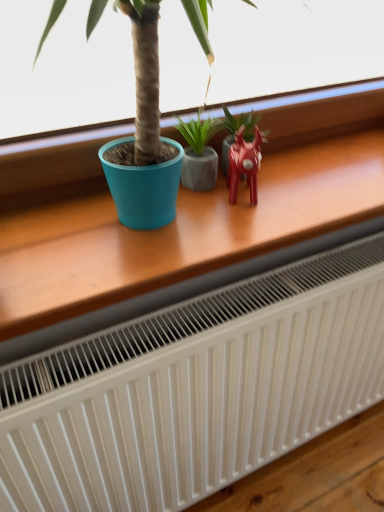
Find the location of `matte gray pot at center, which is counted as the first houseplant, starting from the left`. matte gray pot at center, which is counted as the first houseplant, starting from the left is located at coordinates (199, 150).

The image size is (384, 512). What are the coordinates of `glossy plastic reindeer at center right` in the screenshot? It's located at (244, 163).

You are a GUI agent. You are given a task and a screenshot of the screen. Output one action in this format:
    pyautogui.click(x=<x>, y=<y>)
    Task: Click on the matte gray pot at center, which is counted as the first houseplant, starting from the left
    Image resolution: width=384 pixels, height=512 pixels.
    Given the screenshot: What is the action you would take?
    pyautogui.click(x=199, y=150)

Does point (251, 180) lie in front of point (204, 166)?

That is True.

How different are the orientations of glossy plastic reindeer at center right and matte gray pot at center, which is counted as the first houseplant, starting from the left, in degrees?

There is a 28-degree angle between the facing directions of glossy plastic reindeer at center right and matte gray pot at center, which is counted as the first houseplant, starting from the left.

Is the position of glossy plastic reindeer at center right more distant than that of matte gray pot at center, the 2th houseplant when ordered from right to left?

No, glossy plastic reindeer at center right is in front of matte gray pot at center, the 2th houseplant when ordered from right to left.

From the image's perspective, is glossy plastic reindeer at center right below matte gray pot at center, the 2th houseplant when ordered from right to left?

Yes, from the image's perspective, glossy plastic reindeer at center right is below matte gray pot at center, the 2th houseplant when ordered from right to left.

How many degrees apart are the facing directions of matte gray pot at center, which is counted as the first houseplant, starting from the left, and glossy ceramic plant at center, the second houseplant when ordered from left to right?

0.436 degrees separate the facing orientations of matte gray pot at center, which is counted as the first houseplant, starting from the left, and glossy ceramic plant at center, the second houseplant when ordered from left to right.

Does matte gray pot at center, the 2th houseplant when ordered from right to left, have a larger size compared to glossy ceramic plant at center, the 1th houseplant positioned from the right?

No.

In terms of height, does matte gray pot at center, which is counted as the first houseplant, starting from the left, look taller or shorter compared to glossy ceramic plant at center, the 1th houseplant positioned from the right?

matte gray pot at center, which is counted as the first houseplant, starting from the left, is taller than glossy ceramic plant at center, the 1th houseplant positioned from the right.

Who is shorter, matte gray pot at center, the 2th houseplant when ordered from right to left, or wooden table at center?

Standing shorter between the two is matte gray pot at center, the 2th houseplant when ordered from right to left.

Is matte gray pot at center, the 2th houseplant when ordered from right to left, inside the boundaries of wooden table at center, or outside?

matte gray pot at center, the 2th houseplant when ordered from right to left, is contained in wooden table at center.

From the image's perspective, is matte gray pot at center, which is counted as the first houseplant, starting from the left, positioned above or below wooden table at center?

From the image's perspective, matte gray pot at center, which is counted as the first houseplant, starting from the left, appears above wooden table at center.

Is glossy plastic reindeer at center right completely or partially inside glossy ceramic plant at center, the 1th houseplant positioned from the right?

Actually, glossy plastic reindeer at center right is outside glossy ceramic plant at center, the 1th houseplant positioned from the right.

Can you tell me how much glossy ceramic plant at center, the second houseplant when ordered from left to right, and glossy plastic reindeer at center right differ in facing direction?

They differ by 28.4 degrees in their facing directions.

Is glossy ceramic plant at center, the second houseplant when ordered from left to right, oriented away from glossy plastic reindeer at center right?

No, glossy plastic reindeer at center right is not at the back of glossy ceramic plant at center, the second houseplant when ordered from left to right.

Is point (227, 121) farther from camera compared to point (235, 168)?

Yes, point (227, 121) is behind point (235, 168).

Does matte gray pot at center, which is counted as the first houseplant, starting from the left, turn towards glossy plastic reindeer at center right?

Yes.

How many degrees apart are the facing directions of matte gray pot at center, which is counted as the first houseplant, starting from the left, and glossy plastic reindeer at center right?

28 degrees.

Is matte gray pot at center, the 2th houseplant when ordered from right to left, next to glossy plastic reindeer at center right and touching it?

Indeed, matte gray pot at center, the 2th houseplant when ordered from right to left, and glossy plastic reindeer at center right are beside each other and touching.

Considering their positions, is matte gray pot at center, the 2th houseplant when ordered from right to left, located in front of or behind glossy plastic reindeer at center right?

matte gray pot at center, the 2th houseplant when ordered from right to left, is positioned farther from the viewer than glossy plastic reindeer at center right.

Is glossy plastic reindeer at center right located within wooden table at center?

Yes, glossy plastic reindeer at center right is a part of wooden table at center.

Considering the sizes of objects wooden table at center and glossy plastic reindeer at center right in the image provided, who is shorter, wooden table at center or glossy plastic reindeer at center right?

glossy plastic reindeer at center right is shorter.

Does wooden table at center appear on the right side of glossy plastic reindeer at center right?

Incorrect, wooden table at center is not on the right side of glossy plastic reindeer at center right.

Is wooden table at center next to glossy plastic reindeer at center right and touching it?

No, wooden table at center is not in contact with glossy plastic reindeer at center right.

From the picture: Is glossy ceramic plant at center, the 1th houseplant positioned from the right, closer to camera compared to matte gray pot at center, which is counted as the first houseplant, starting from the left?

That is False.

Is glossy ceramic plant at center, the second houseplant when ordered from left to right, not near matte gray pot at center, which is counted as the first houseplant, starting from the left?

No, glossy ceramic plant at center, the second houseplant when ordered from left to right, is in close proximity to matte gray pot at center, which is counted as the first houseplant, starting from the left.

Is point (250, 124) farther from viewer compared to point (214, 118)?

Yes, point (250, 124) is farther from viewer.

From the image's perspective, which houseplant is the 1st one above the glossy plastic reindeer at center right? Please provide its 2D coordinates.

[(199, 150)]

Where is `houseplant located in front of the glossy ceramic plant at center, the 1th houseplant positioned from the right`? houseplant located in front of the glossy ceramic plant at center, the 1th houseplant positioned from the right is located at coordinates (199, 150).

Consider the image. Considering their positions, is matte gray pot at center, the 2th houseplant when ordered from right to left, positioned closer to wooden table at center than glossy plastic reindeer at center right?

The object closer to wooden table at center is glossy plastic reindeer at center right.

Which object lies further to the anchor point glossy ceramic plant at center, the second houseplant when ordered from left to right, wooden table at center or glossy plastic reindeer at center right?

wooden table at center is positioned further to the anchor glossy ceramic plant at center, the second houseplant when ordered from left to right.

Based on their spatial positions, is wooden table at center or glossy ceramic plant at center, the second houseplant when ordered from left to right, closer to glossy plastic reindeer at center right?

glossy ceramic plant at center, the second houseplant when ordered from left to right, lies closer to glossy plastic reindeer at center right than the other object.

Considering their positions, is glossy ceramic plant at center, the 1th houseplant positioned from the right, positioned further to matte gray pot at center, the 2th houseplant when ordered from right to left, than glossy plastic reindeer at center right?

glossy plastic reindeer at center right is positioned further to the anchor matte gray pot at center, the 2th houseplant when ordered from right to left.

When comparing their distances from wooden table at center, does glossy plastic reindeer at center right or matte gray pot at center, the 2th houseplant when ordered from right to left, seem further?

Among the two, matte gray pot at center, the 2th houseplant when ordered from right to left, is located further to wooden table at center.

Considering their positions, is matte gray pot at center, the 2th houseplant when ordered from right to left, positioned further to glossy plastic reindeer at center right than wooden table at center?

wooden table at center is positioned further to the anchor glossy plastic reindeer at center right.

When comparing their distances from wooden table at center, does matte gray pot at center, which is counted as the first houseplant, starting from the left, or glossy ceramic plant at center, the second houseplant when ordered from left to right, seem further?

glossy ceramic plant at center, the second houseplant when ordered from left to right.

Considering their positions, is wooden table at center positioned closer to glossy ceramic plant at center, the 1th houseplant positioned from the right, than matte gray pot at center, which is counted as the first houseplant, starting from the left?

The object closer to glossy ceramic plant at center, the 1th houseplant positioned from the right, is matte gray pot at center, which is counted as the first houseplant, starting from the left.

Where is `miniature located between wooden table at center and matte gray pot at center, the 2th houseplant when ordered from right to left, in the depth direction`? The width and height of the screenshot is (384, 512). miniature located between wooden table at center and matte gray pot at center, the 2th houseplant when ordered from right to left, in the depth direction is located at coordinates (244, 163).

Locate an element on the screen. houseplant between matte gray pot at center, which is counted as the first houseplant, starting from the left, and glossy plastic reindeer at center right, in the horizontal direction is located at coordinates (235, 131).

The height and width of the screenshot is (512, 384). I want to click on houseplant between wooden table at center and glossy ceramic plant at center, the second houseplant when ordered from left to right, from front to back, so click(199, 150).

Where is `miniature located between wooden table at center and glossy ceramic plant at center, the 1th houseplant positioned from the right, in the depth direction`? miniature located between wooden table at center and glossy ceramic plant at center, the 1th houseplant positioned from the right, in the depth direction is located at coordinates point(244,163).